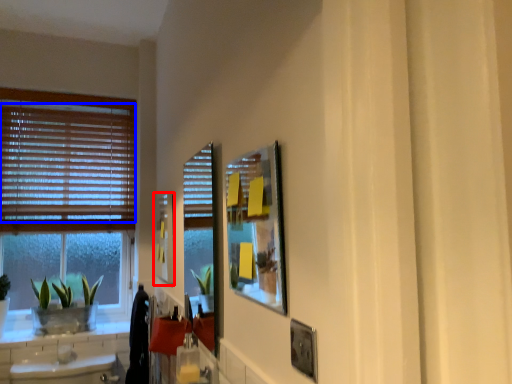
Question: Which point is further to the camera, picture frame (highlighted by a red box) or blind (highlighted by a blue box)?

Choices:
 (A) picture frame
 (B) blind

Answer: (B)